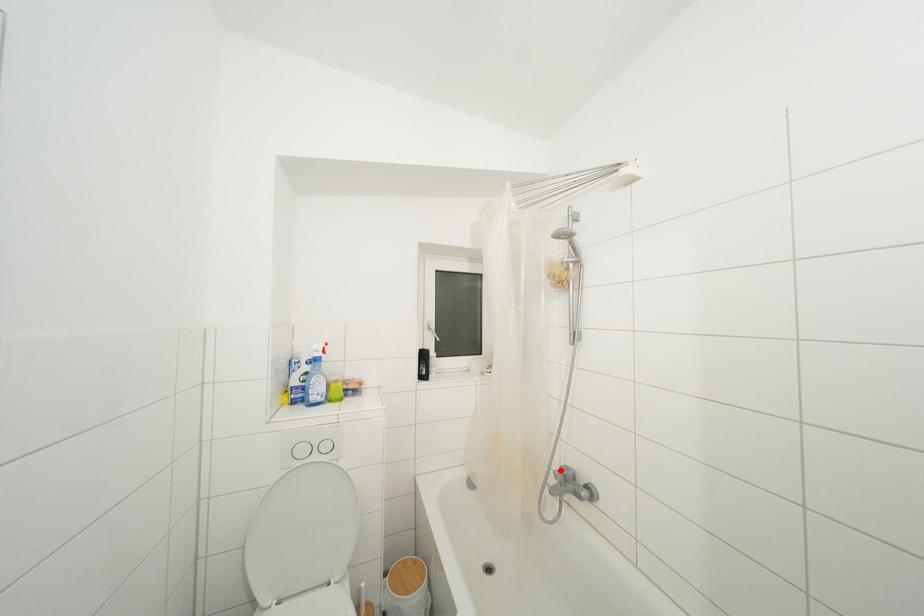
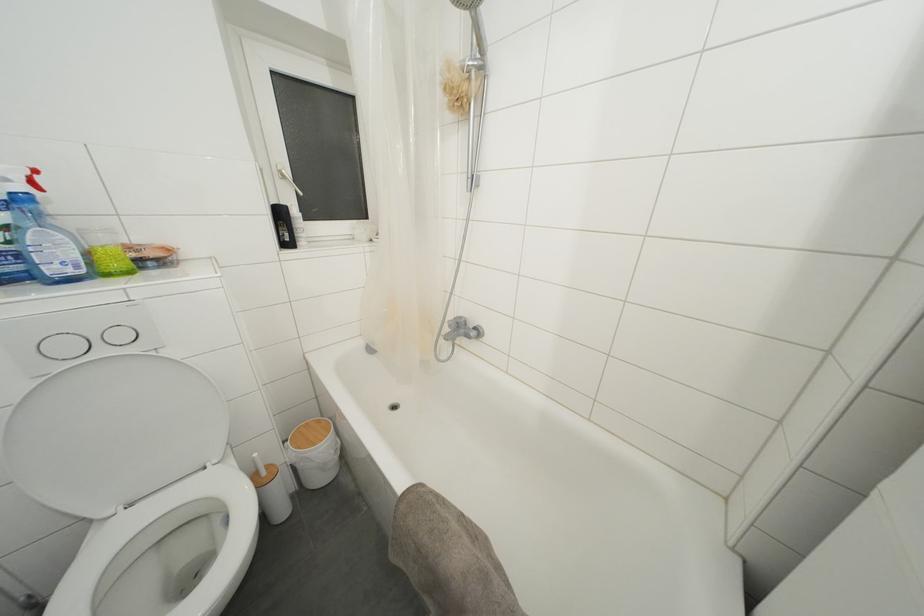
Where in the second image is the point corresponding to the highlighted location from the first image?

(455, 321)